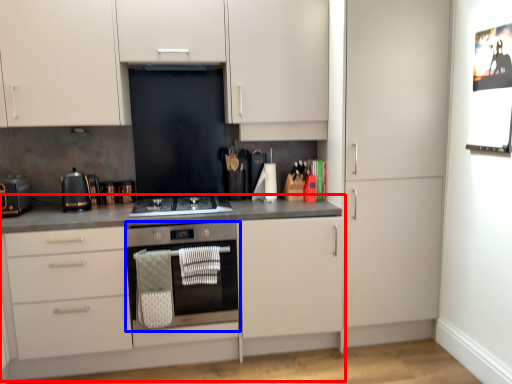
Question: Which of the following is the closest to the observer, countertop (highlighted by a red box) or home appliance (highlighted by a blue box)?

Choices:
 (A) countertop
 (B) home appliance

Answer: (A)